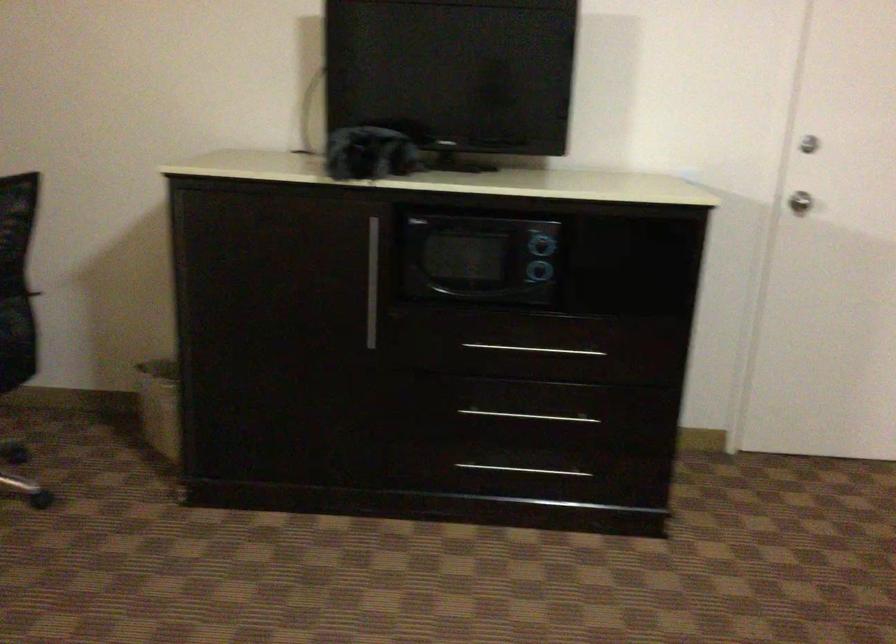
This screenshot has width=896, height=644. What do you see at coordinates (803, 180) in the screenshot? I see `the silver door handle` at bounding box center [803, 180].